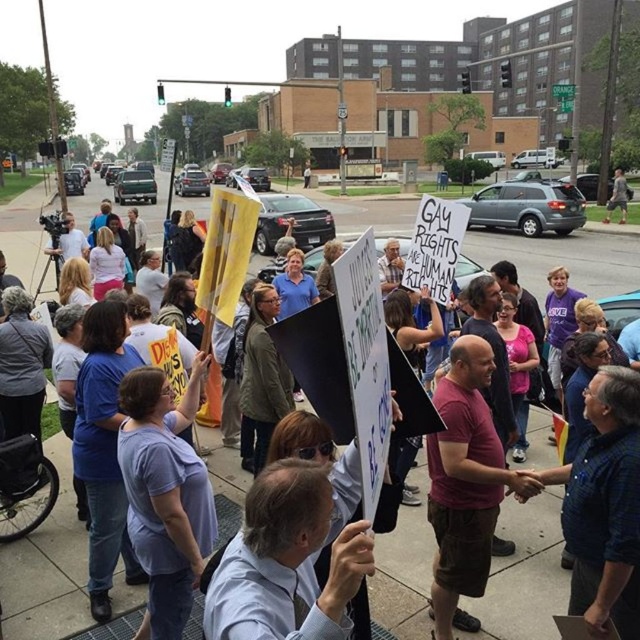
You are a delivery person who needs to cross the sidewalk to reach a delivery point on the other side. The concrete sidewalk at center has a width of 3.70 meters. Can you safely cross it if your delivery cart is 1.2 meters wide?

The concrete sidewalk at center is 3.70 meters wide. Since your delivery cart is only 1.2 meters wide, there is enough space to safely cross the sidewalk.